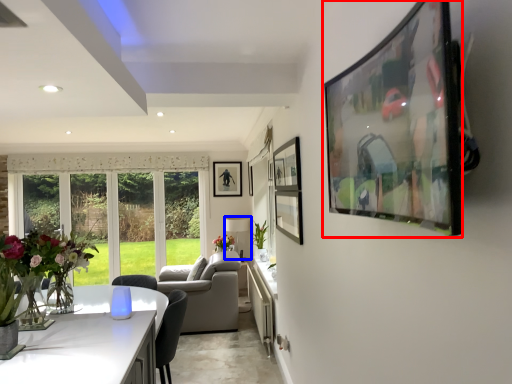
Question: Which of the following is the farthest to the observer, picture frame (highlighted by a red box) or lamp (highlighted by a blue box)?

Choices:
 (A) picture frame
 (B) lamp

Answer: (B)